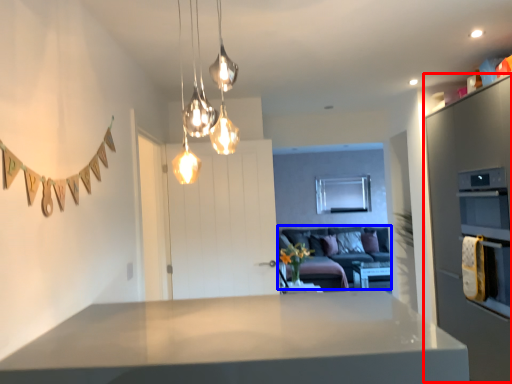
Question: Which point is further to the camera, cabinetry (highlighted by a red box) or couch (highlighted by a blue box)?

Choices:
 (A) cabinetry
 (B) couch

Answer: (B)